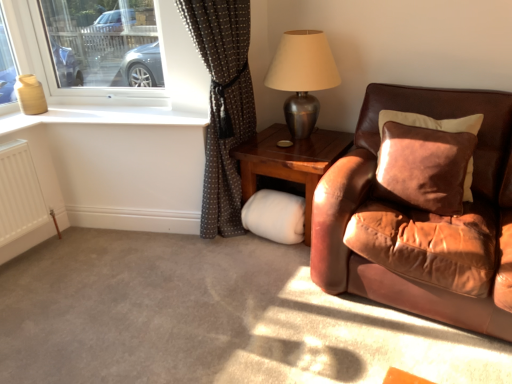
Identify the location of vacant area that lies to the right of white matte radiator at lower left. (74, 257).